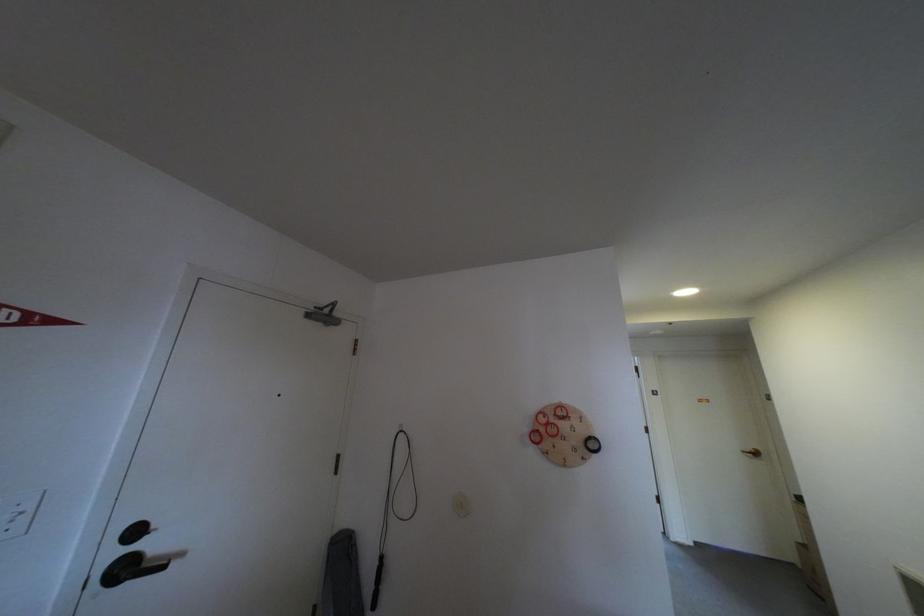
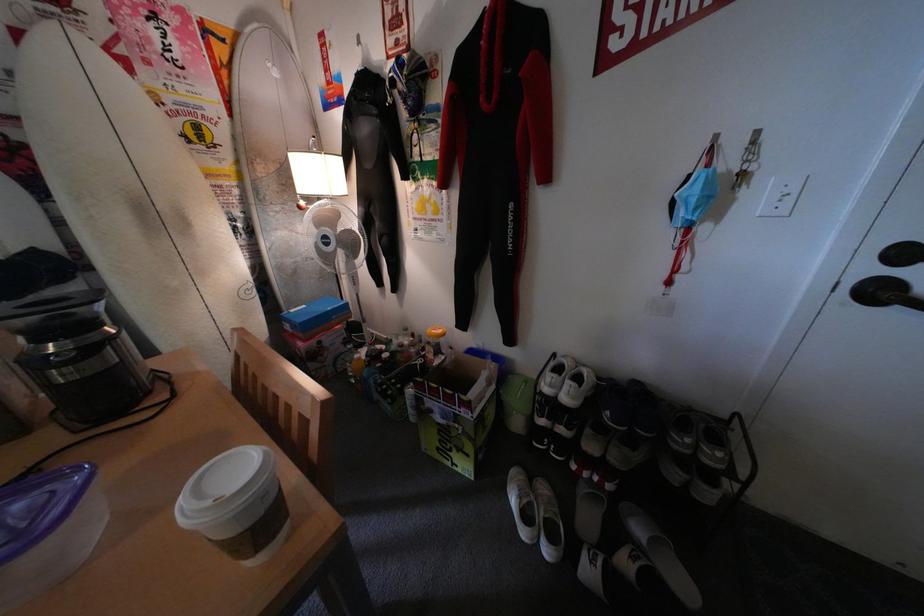
Find the pixel in the second image that matches the point at 26,523 in the first image.

(795, 201)